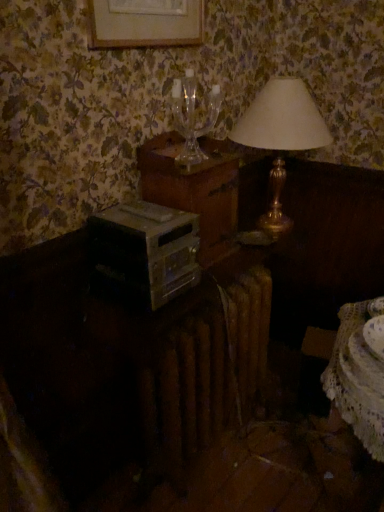
Question: Is transparent glass wine glass at upper center wider or thinner than wooden nightstand at center?

Choices:
 (A) thin
 (B) wide

Answer: (A)

Question: Considering their positions, is transparent glass wine glass at upper center located in front of or behind wooden nightstand at center?

Choices:
 (A) front
 (B) behind

Answer: (A)

Question: Which object is the closest to the gold metallic lamp at upper right?

Choices:
 (A) silver metallic stereo at center
 (B) white lace table at lower right
 (C) wooden nightstand at center
 (D) transparent glass wine glass at upper center

Answer: (C)

Question: Which object is positioned farthest from the gold metallic lamp at upper right?

Choices:
 (A) wooden nightstand at center
 (B) silver metallic stereo at center
 (C) transparent glass wine glass at upper center
 (D) white lace table at lower right

Answer: (D)